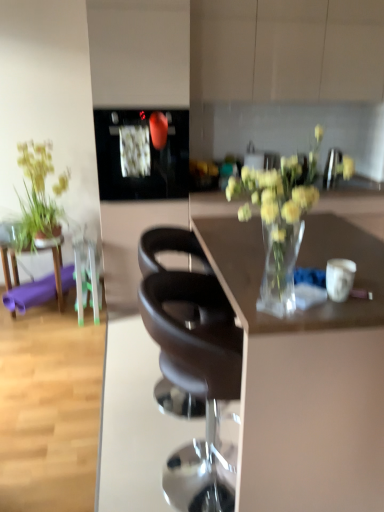
Where is `vacant space that's between purple rubber mat at left and matte black chair at center, marked as the 1th chair in a front-to-back arrangement`? vacant space that's between purple rubber mat at left and matte black chair at center, marked as the 1th chair in a front-to-back arrangement is located at coordinates (87, 376).